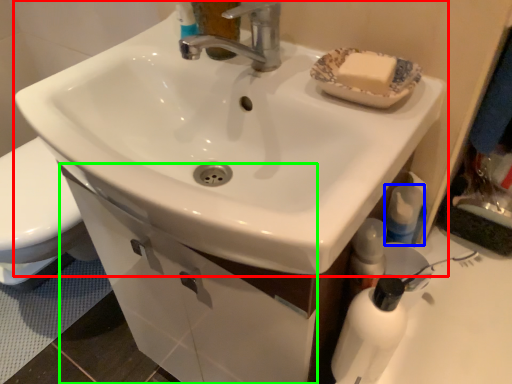
Question: Which object is positioned farthest from sink (highlighted by a red box)? Select from mouthwash (highlighted by a blue box) and drawer (highlighted by a green box).

Choices:
 (A) mouthwash
 (B) drawer

Answer: (A)